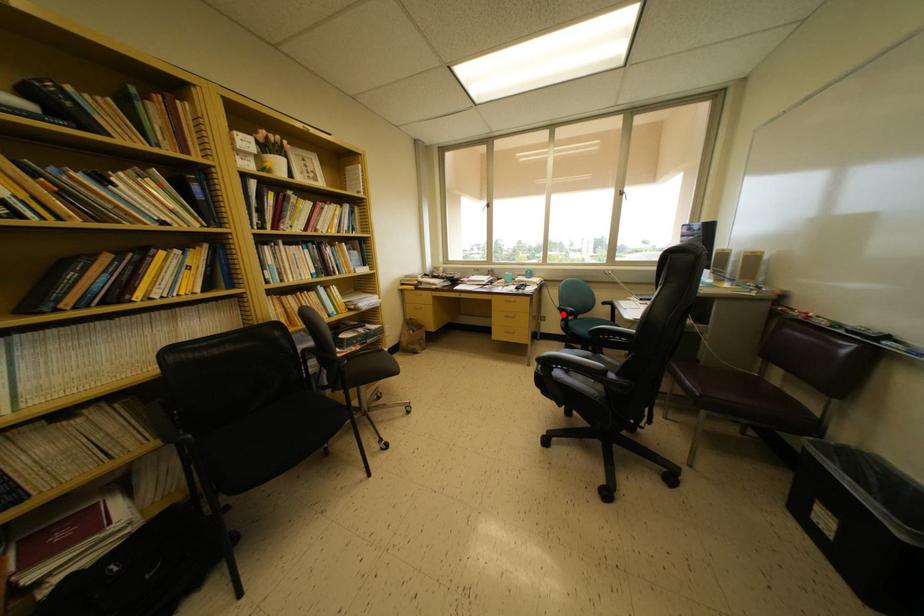
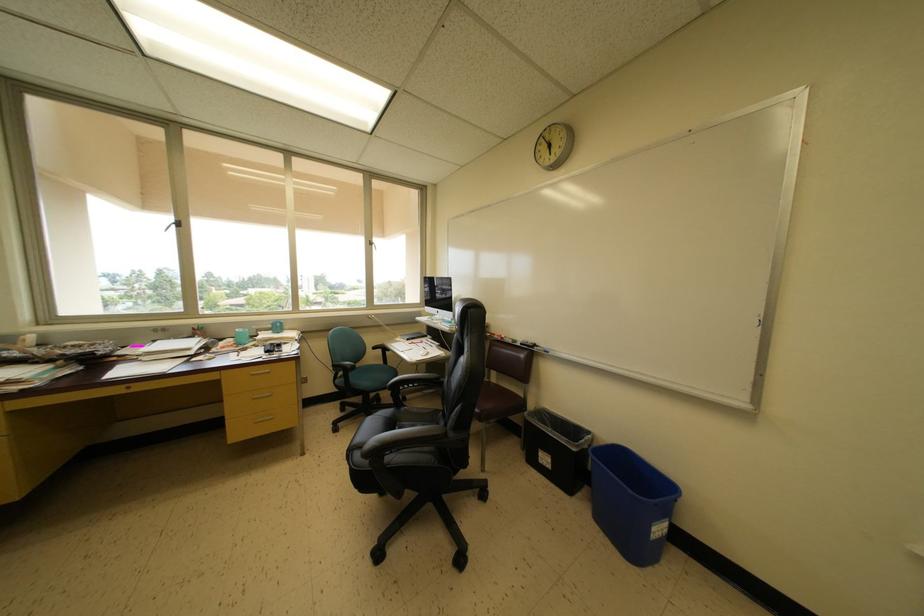
Question: I am providing you with two images of the same scene from different viewpoints. In image1, a red point is highlighted. Considering the same 3D point in image2, which of the following is correct?

Choices:
 (A) It is closer
 (B) It is farther

Answer: (B)